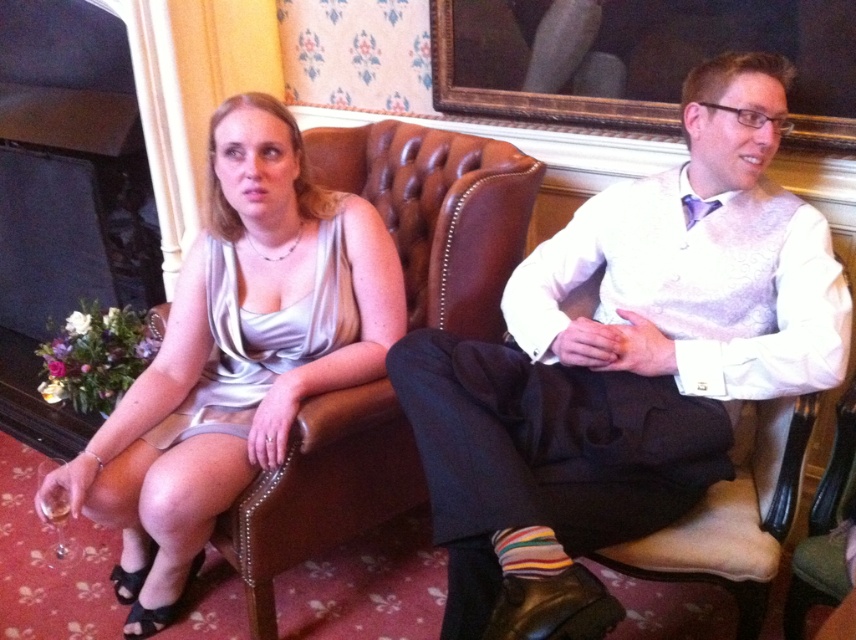
Question: Considering the real-world distances, which object is farthest from the wooden framed mirror at upper center?

Choices:
 (A) striped cotton sock at lower center
 (B) satin dress at center
 (C) satin dress at left
 (D) white textured shirt at center

Answer: (A)

Question: Which is farther from the wooden framed mirror at upper center?

Choices:
 (A) striped cotton sock at lower center
 (B) satin dress at center
 (C) satin dress at left

Answer: (A)

Question: Is white textured shirt at center to the left of satin dress at center from the viewer's perspective?

Choices:
 (A) no
 (B) yes

Answer: (A)

Question: Is wooden framed mirror at upper center to the right of satin dress at left from the viewer's perspective?

Choices:
 (A) no
 (B) yes

Answer: (B)

Question: Which object is closer to the camera taking this photo?

Choices:
 (A) wooden framed mirror at upper center
 (B) satin dress at center
 (C) striped cotton sock at lower center
 (D) white textured shirt at center

Answer: (D)

Question: Is white textured shirt at center below wooden framed mirror at upper center?

Choices:
 (A) yes
 (B) no

Answer: (A)